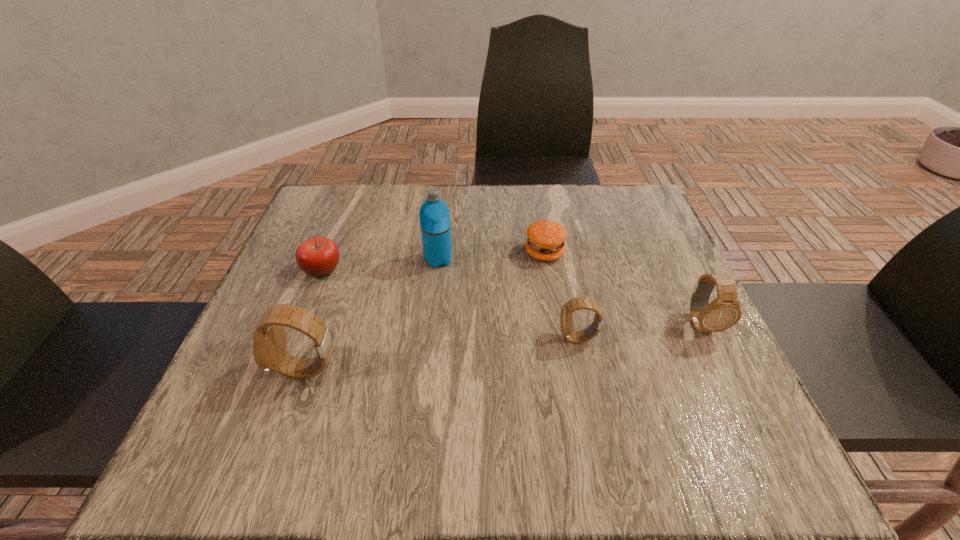
I want to click on vacant point located between the second shortest object and the second watch from left to right, so tap(450, 304).

Locate an element on the screen. Image resolution: width=960 pixels, height=540 pixels. unoccupied area between the shortest watch and the second shortest object is located at coordinates (450, 304).

The image size is (960, 540). In order to click on free spot between the shortest watch and the nearest object in this screenshot , I will do `click(443, 354)`.

Find the location of `free space between the second shortest object and the tallest object`. free space between the second shortest object and the tallest object is located at coordinates (380, 265).

Locate an element on the screen. free space between the third object from left to right and the second watch from right to left is located at coordinates (508, 299).

What are the coordinates of `free space between the third tallest object and the tallest object` in the screenshot? It's located at (569, 292).

Where is `the fourth closest object to the second tallest watch`? This screenshot has height=540, width=960. the fourth closest object to the second tallest watch is located at coordinates (269, 341).

Identify which object is the fifth closest to the tallest object. Please provide its 2D coordinates. Your answer should be formatted as a tuple, i.e. [(x, y)], where the tuple contains the x and y coordinates of a point satisfying the conditions above.

[(724, 312)]

Identify which watch is the second nearest to the second watch from right to left. Please provide its 2D coordinates. Your answer should be formatted as a tuple, i.e. [(x, y)], where the tuple contains the x and y coordinates of a point satisfying the conditions above.

[(269, 341)]

Select which watch appears as the second closest to the patty. Please provide its 2D coordinates. Your answer should be formatted as a tuple, i.e. [(x, y)], where the tuple contains the x and y coordinates of a point satisfying the conditions above.

[(724, 312)]